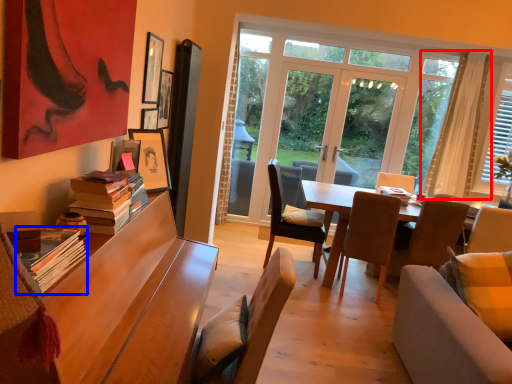
Question: Which of the following is the closest to the observer, curtain (highlighted by a red box) or book (highlighted by a blue box)?

Choices:
 (A) curtain
 (B) book

Answer: (B)